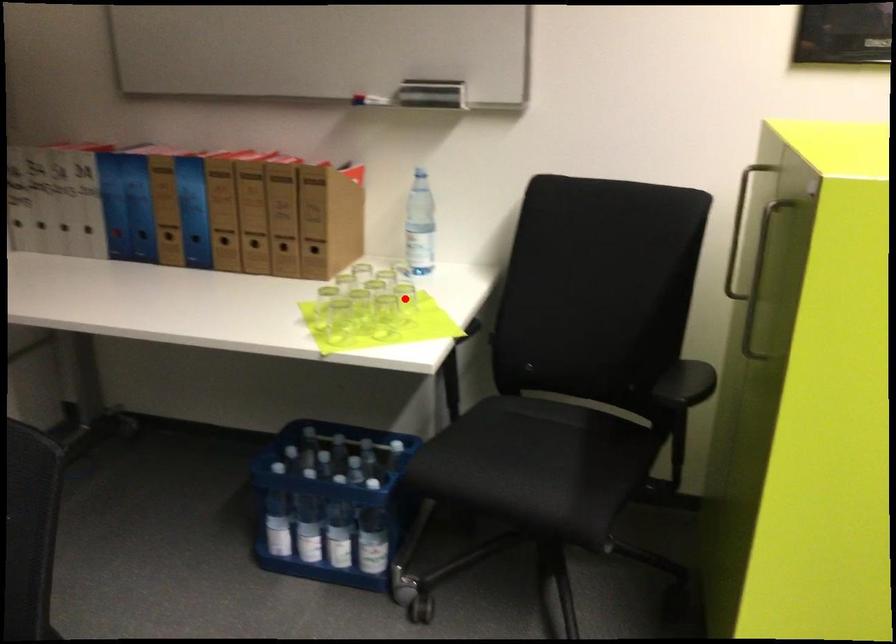
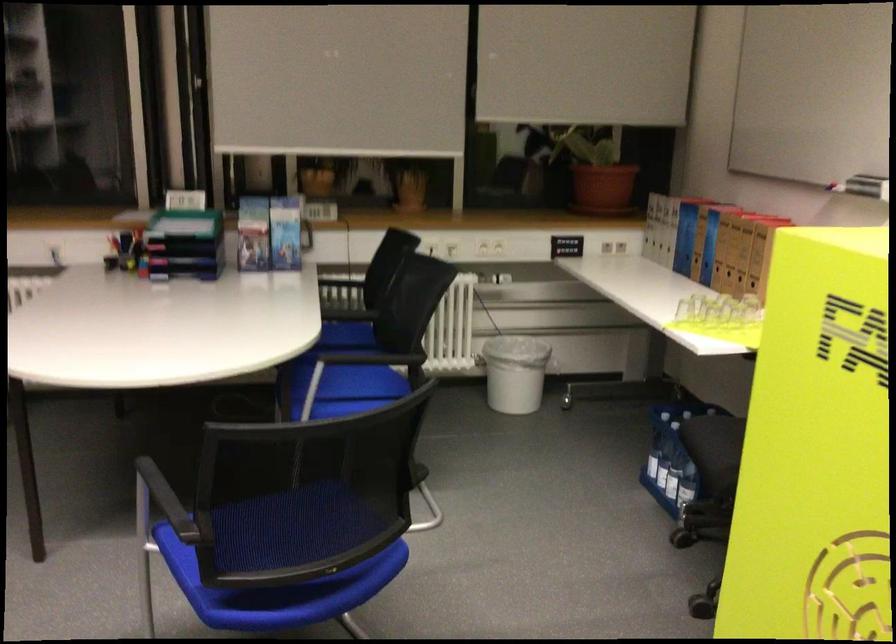
Question: I am providing you with two images of the same scene from different viewpoints. A red point is marked on the first image. Is the red point's position out of view in image 2?

Choices:
 (A) Yes
 (B) No

Answer: (A)